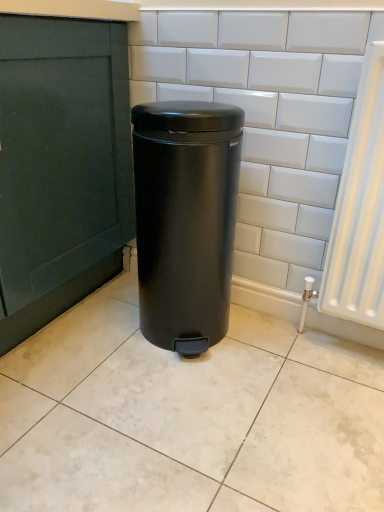
The image size is (384, 512). Identify the location of free space in front of matte black trash can at center. (181, 397).